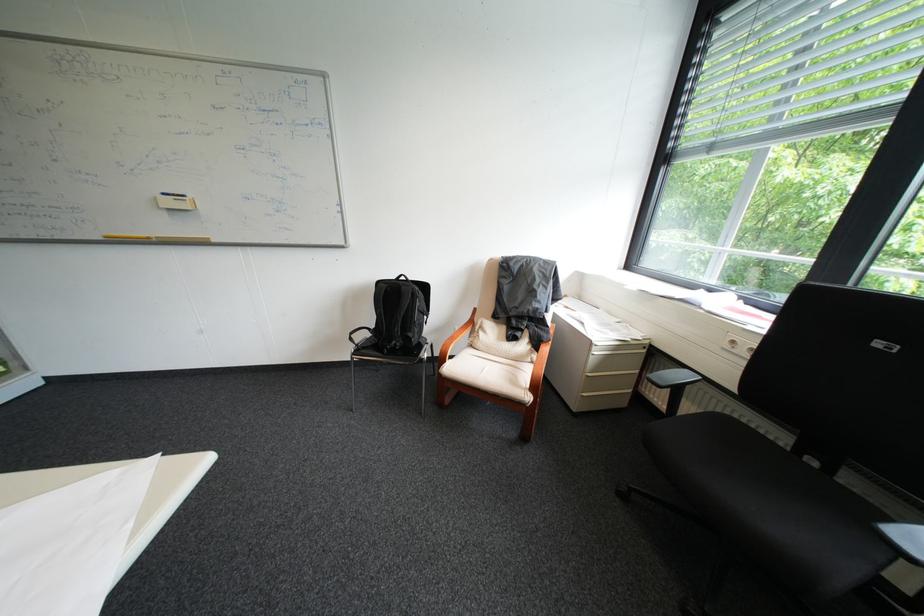
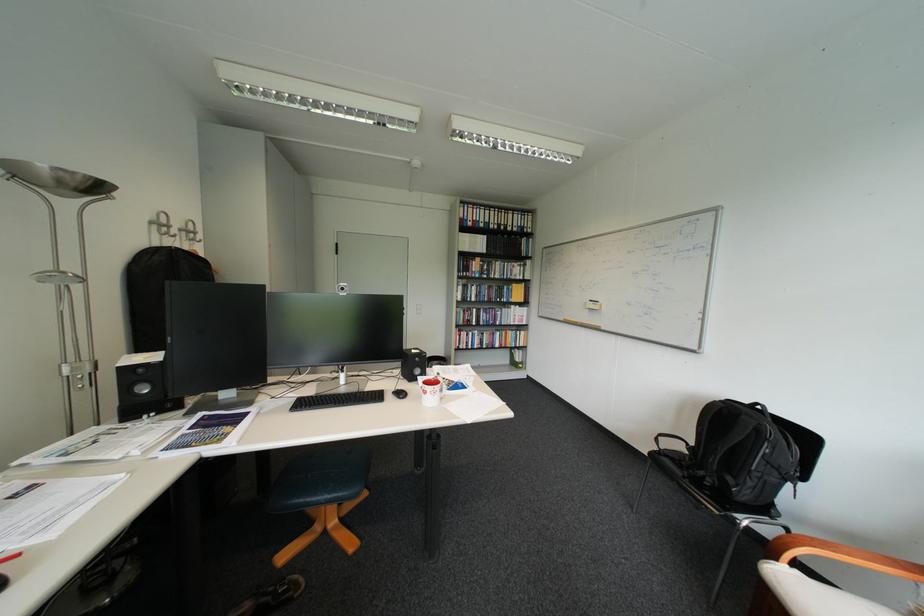
Locate, in the second image, the point that corresponds to point (415, 288) in the first image.

(756, 418)